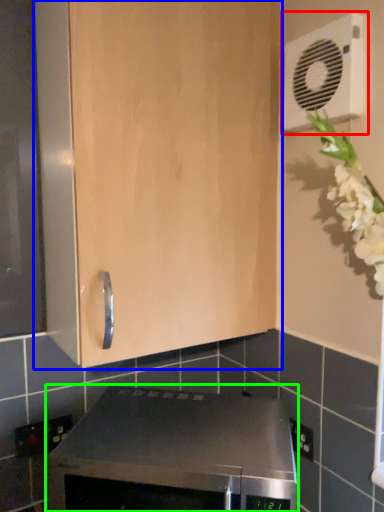
Question: Estimate the real-world distances between objects in this image. Which object is farther from air conditioning (highlighted by a red box), cabinetry (highlighted by a blue box) or home appliance (highlighted by a green box)?

Choices:
 (A) cabinetry
 (B) home appliance

Answer: (B)